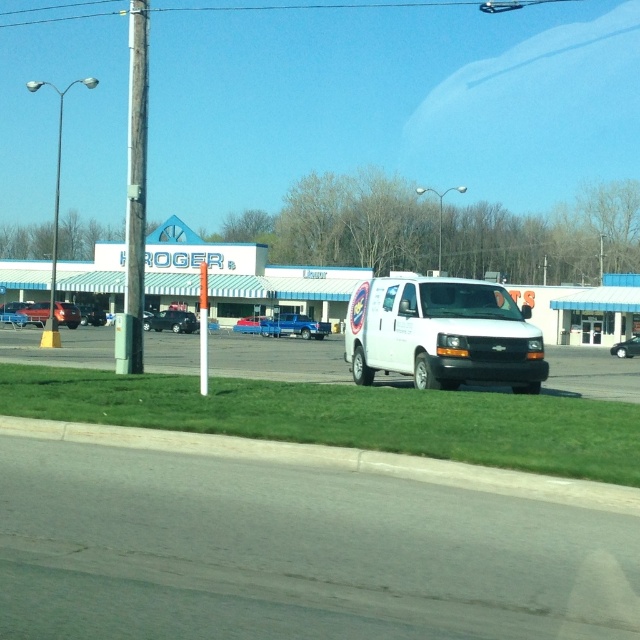
Question: Can you confirm if white matte van at center is thinner than shiny black sedan at center?

Choices:
 (A) yes
 (B) no

Answer: (B)

Question: Among these points, which one is farthest from the camera?

Choices:
 (A) (168, 310)
 (B) (273, 336)

Answer: (A)

Question: Which object is the closest to the shiny black sedan at center?

Choices:
 (A) wooden utility pole at left
 (B) shiny black suv at center-left
 (C) white matte van at center
 (D) white plastic pole at center

Answer: (D)

Question: Is white van at center smaller than metallic red car at center?

Choices:
 (A) yes
 (B) no

Answer: (B)

Question: Does white van at center appear over shiny black sedan at center?

Choices:
 (A) yes
 (B) no

Answer: (A)

Question: Which point is closer to the camera?

Choices:
 (A) metallic red car at center
 (B) shiny black suv at center-left

Answer: (B)